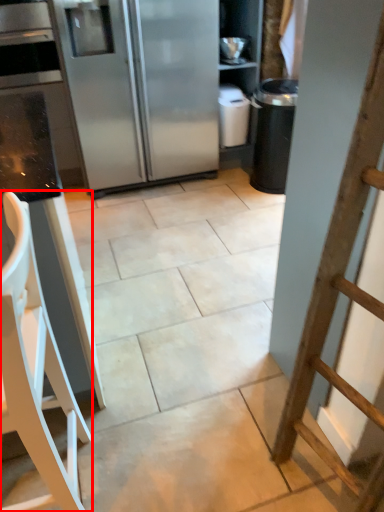
Question: From the image, what is the correct spatial relationship of furniture (annotated by the red box) in relation to refrigerator?

Choices:
 (A) right
 (B) left

Answer: (B)